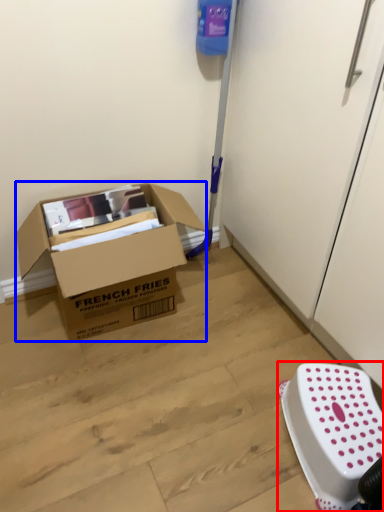
Question: Which object is further to the camera taking this photo, stool (highlighted by a red box) or box (highlighted by a blue box)?

Choices:
 (A) stool
 (B) box

Answer: (B)